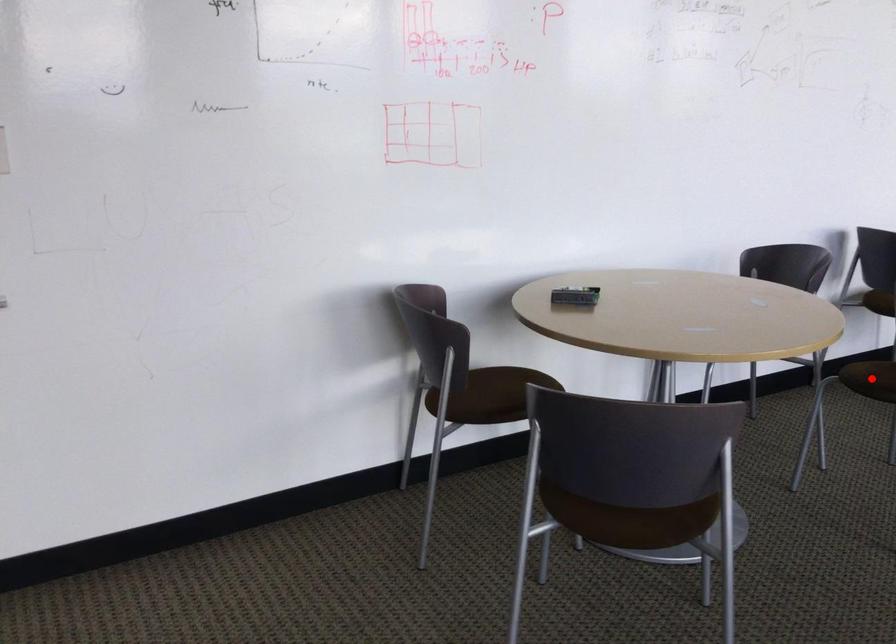
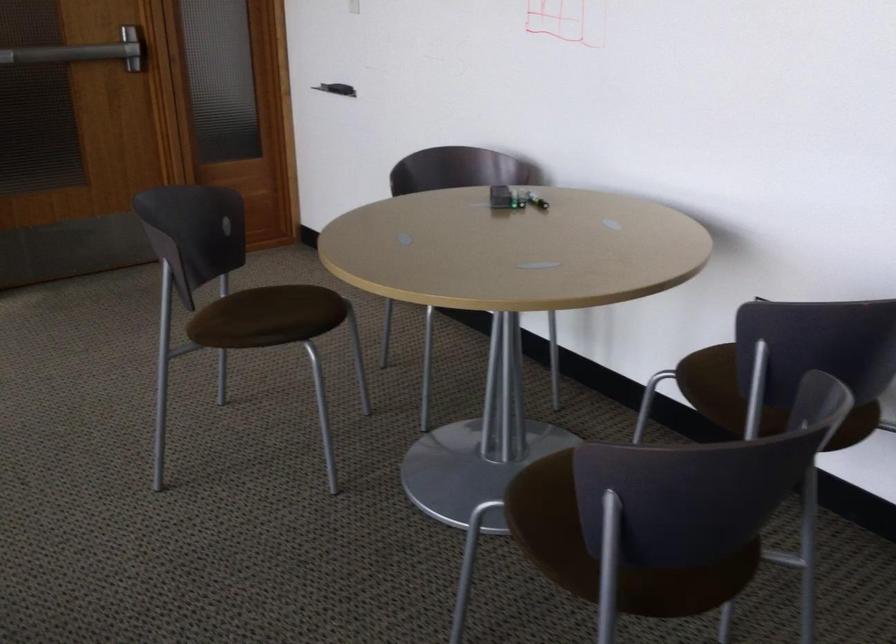
Question: I am providing you with two images of the same scene from different viewpoints. A red point is marked on the first image. At the location where the point appears in image 1, is it still visible in image 2?

Choices:
 (A) Yes
 (B) No

Answer: (B)